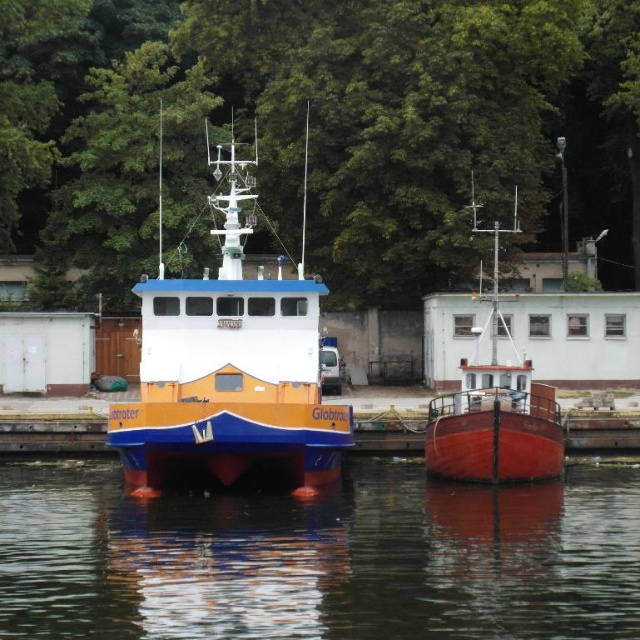
Question: Does glossy water at lower center have a greater width compared to smooth red boat at center?

Choices:
 (A) no
 (B) yes

Answer: (B)

Question: Can you confirm if glossy water at lower center is bigger than orange matte boat at center?

Choices:
 (A) no
 (B) yes

Answer: (A)

Question: Which object is closer to the camera taking this photo?

Choices:
 (A) smooth red boat at center
 (B) orange matte boat at center

Answer: (B)

Question: Is glossy water at lower center thinner than smooth red boat at center?

Choices:
 (A) no
 (B) yes

Answer: (A)

Question: Which of these objects is positioned closest to the glossy water at lower center?

Choices:
 (A) smooth red boat at center
 (B) green leafy tree at upper center
 (C) orange matte boat at center

Answer: (C)

Question: Which point is farther from the camera taking this photo?

Choices:
 (A) (403, 618)
 (B) (241, 292)
 (C) (516, 412)

Answer: (B)